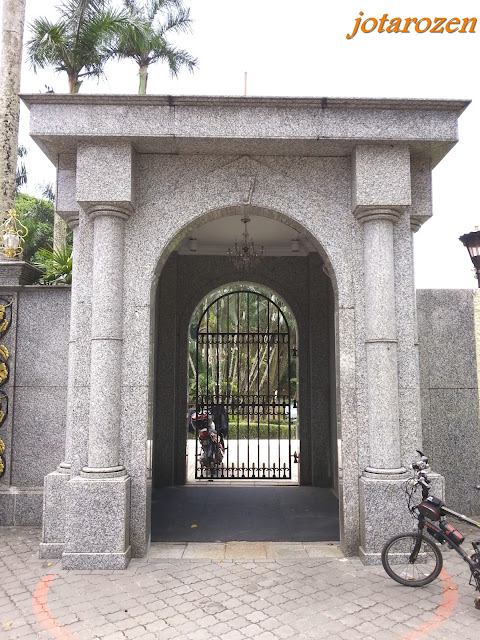
Where is `gold leafing design`? Image resolution: width=480 pixels, height=640 pixels. gold leafing design is located at coordinates (3, 317), (6, 349), (4, 372), (3, 448).